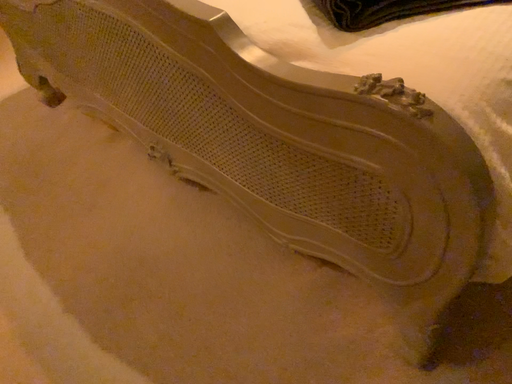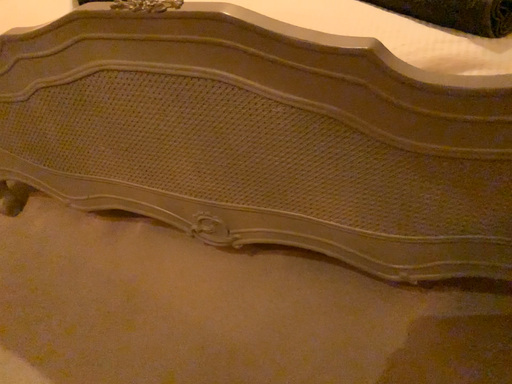
Question: Which way did the camera rotate in the video?

Choices:
 (A) rotated downward
 (B) rotated upward

Answer: (B)